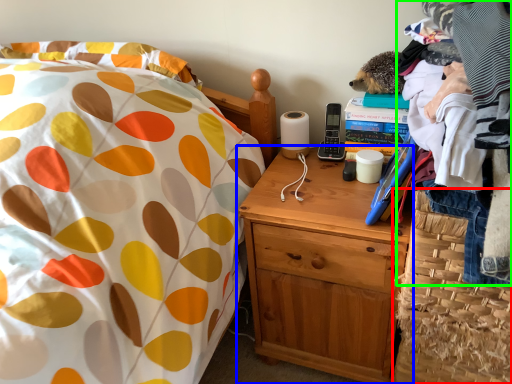
Question: Which object is positioned farthest from basket (highlighted by a red box)? Select from nightstand (highlighted by a blue box) and clothing (highlighted by a green box).

Choices:
 (A) nightstand
 (B) clothing

Answer: (B)